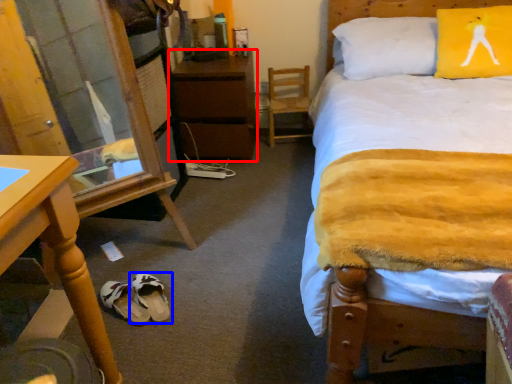
Question: Which point is further to the camera, nightstand (highlighted by a red box) or footwear (highlighted by a blue box)?

Choices:
 (A) nightstand
 (B) footwear

Answer: (A)